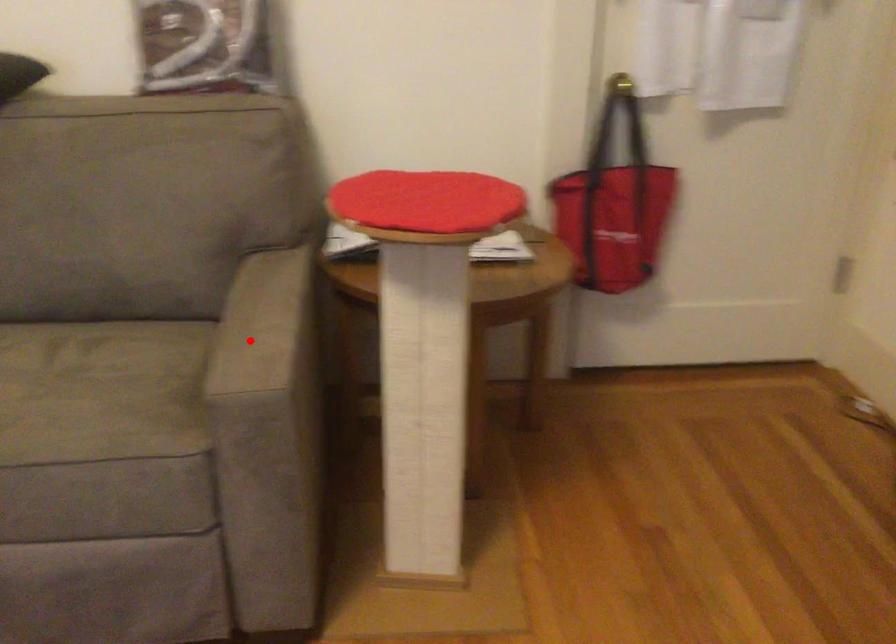
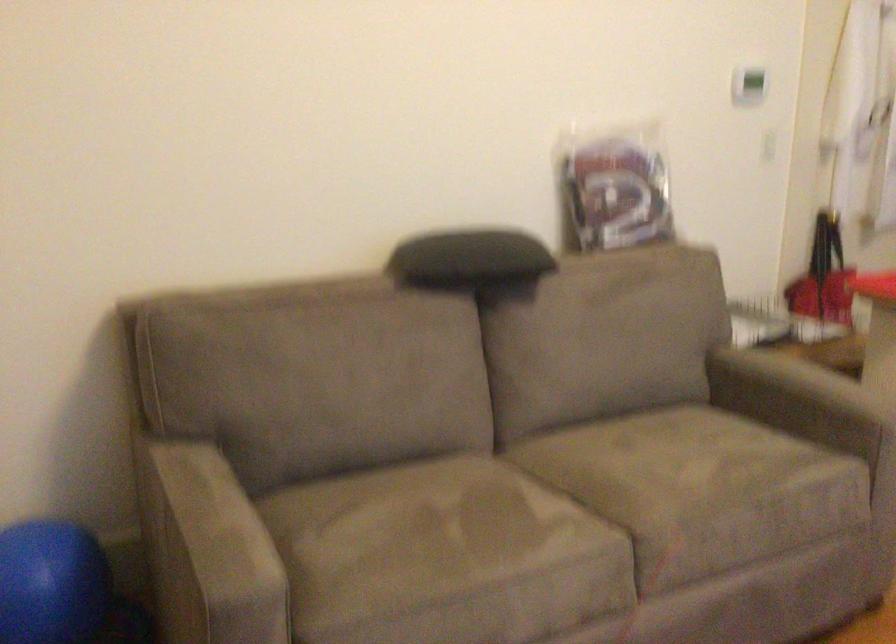
Question: I am providing you with two images of the same scene from different viewpoints. In image1, a red point is highlighted. Considering the same 3D point in image2, which of the following is correct?

Choices:
 (A) It is closer
 (B) It is farther

Answer: (B)